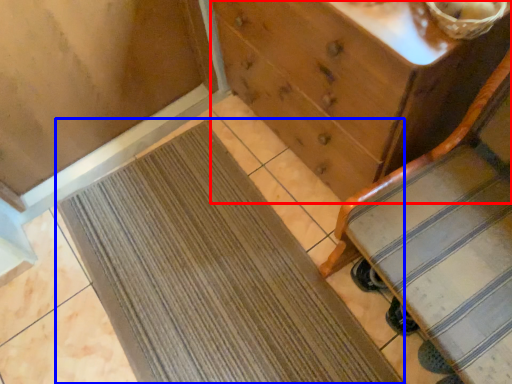
Question: Among these objects, which one is nearest to the camera, chest of drawers (highlighted by a red box) or doormat (highlighted by a blue box)?

Choices:
 (A) chest of drawers
 (B) doormat

Answer: (A)